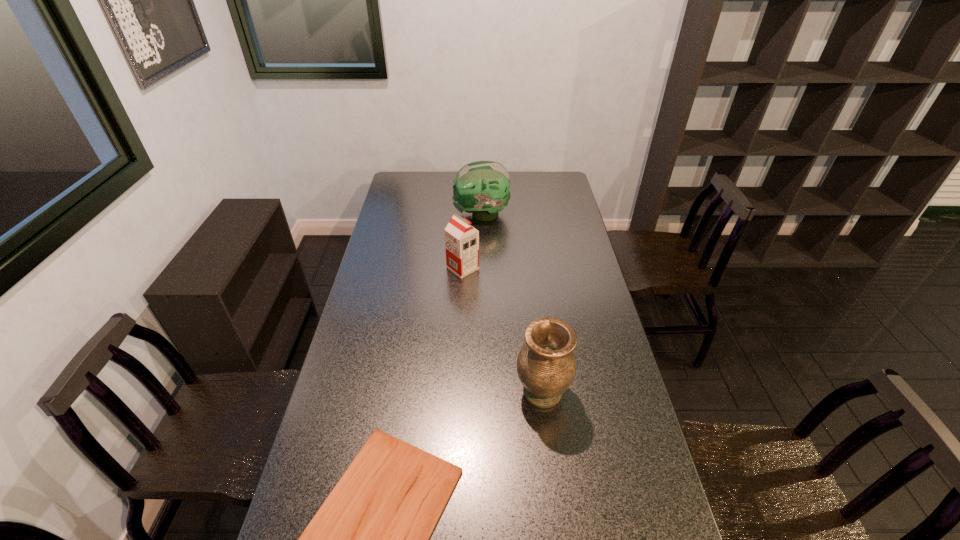
The height and width of the screenshot is (540, 960). In the image, there is a desktop. Identify the location of vacant space at the right edge. (571, 224).

This screenshot has width=960, height=540. I want to click on free space that is in between the vase and the football helmet, so click(512, 303).

Find the location of a particular element. This screenshot has width=960, height=540. free space between the soya milk and the second nearest object is located at coordinates (502, 330).

Identify which object is the third nearest to the farthest object. Please provide its 2D coordinates. Your answer should be formatted as a tuple, i.e. [(x, y)], where the tuple contains the x and y coordinates of a point satisfying the conditions above.

[(369, 539)]

This screenshot has height=540, width=960. I want to click on the third closest object to the shortest object, so click(x=482, y=188).

In order to click on vacant space that satisfies the following two spatial constraints: 1. on the front side of the second farthest object; 2. on the right side of the second nearest object in this screenshot , I will do `click(457, 392)`.

Image resolution: width=960 pixels, height=540 pixels. What are the coordinates of `vacant area that satisfies the following two spatial constraints: 1. on the visor of the farthest object; 2. on the front side of the second farthest object` in the screenshot? It's located at (481, 268).

The width and height of the screenshot is (960, 540). I want to click on free spot that satisfies the following two spatial constraints: 1. on the visor of the vase; 2. on the right side of the farthest object, so click(x=482, y=392).

Where is `free point that satisfies the following two spatial constraints: 1. on the visor of the third farthest object; 2. on the right side of the farthest object`? free point that satisfies the following two spatial constraints: 1. on the visor of the third farthest object; 2. on the right side of the farthest object is located at coordinates (482, 392).